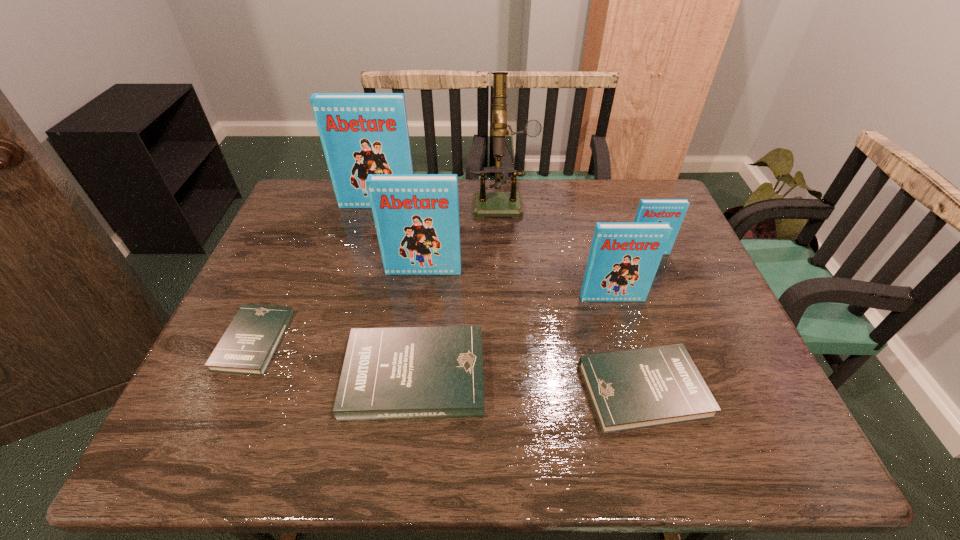
Identify the location of the sixth tallest object. (401, 373).

This screenshot has width=960, height=540. Identify the location of the second shortest book. (632, 389).

Image resolution: width=960 pixels, height=540 pixels. Find the location of `the second biggest dark book`. the second biggest dark book is located at coordinates (632, 389).

Locate an element on the screen. the shortest object is located at coordinates pos(250,341).

At what (x,y) coordinates should I click in order to perform the action: click on the leftmost object. Please return your answer as a coordinate pair (x, y). This screenshot has height=540, width=960. Looking at the image, I should click on (250, 341).

Locate an element on the screen. free spot located at the eyepiece of the brown microscope is located at coordinates (508, 285).

Identify the location of free space located 0.210m on the front cover of the farthest blue book. This screenshot has height=540, width=960. (365, 253).

Find the location of a particular element. This screenshot has width=960, height=540. vacant space located on the front cover of the third tallest object is located at coordinates (414, 344).

Identify the location of blank area located on the front cover of the fourth nearest book. The image size is (960, 540). [625, 343].

Locate an element on the screen. This screenshot has width=960, height=540. vacant space located on the front cover of the smallest blue book is located at coordinates (669, 308).